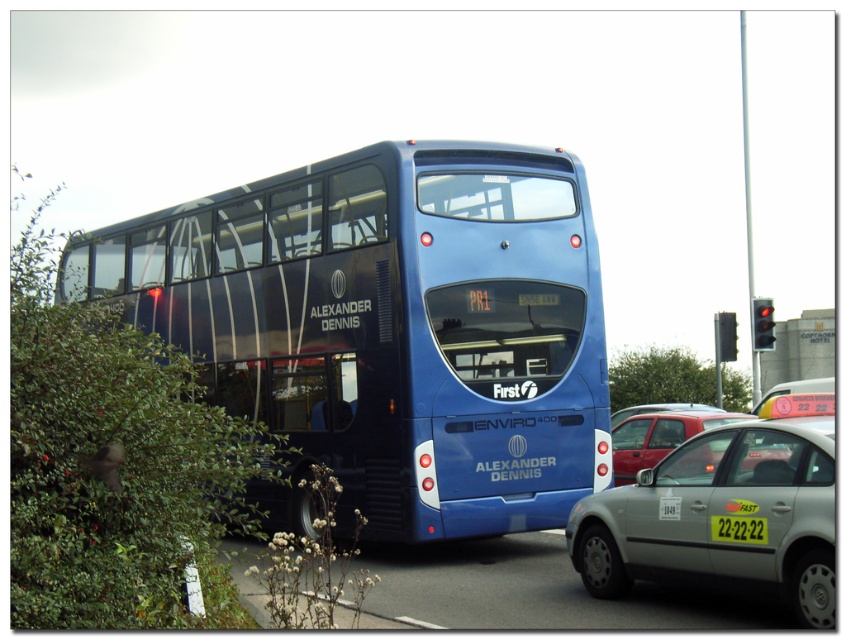
What do you see at coordinates (739, 529) in the screenshot?
I see `green plastic license plate at center` at bounding box center [739, 529].

Does green plastic license plate at center appear on the left side of matte red car at center?

Yes, green plastic license plate at center is to the left of matte red car at center.

Where is `green plastic license plate at center`? The image size is (846, 640). green plastic license plate at center is located at coordinates (739, 529).

Is point (746, 486) positioned after point (722, 531)?

No, (746, 486) is closer to viewer.

Does silver metallic car at center have a greater height compared to green plastic license plate at center?

Indeed, silver metallic car at center has a greater height compared to green plastic license plate at center.

Does point (805, 474) come behind point (756, 531)?

No, it is in front of (756, 531).

Locate an element on the screen. The height and width of the screenshot is (640, 846). silver metallic car at center is located at coordinates (721, 515).

Who is positioned more to the left, silver metallic car at center or matte red car at center?

silver metallic car at center

Based on the photo, can you confirm if silver metallic car at center is positioned below matte red car at center?

Incorrect, silver metallic car at center is not positioned below matte red car at center.

At what (x,y) coordinates should I click in order to perform the action: click on silver metallic car at center. Please return your answer as a coordinate pair (x, y). Looking at the image, I should click on (721, 515).